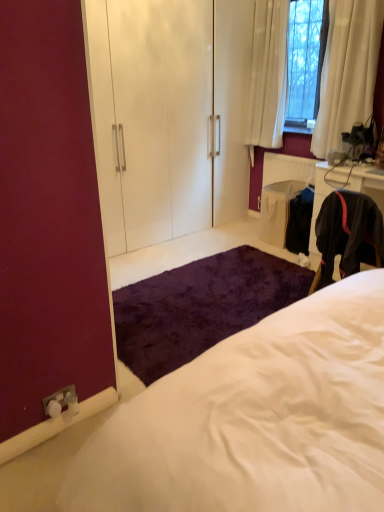
From the picture: What is the approximate width of white fluffy bed at center?

29.13 inches.

At what (x,y) coordinates should I click in order to perform the action: click on white fluffy bed at center. Please return your answer as a coordinate pair (x, y). Looking at the image, I should click on (255, 419).

Locate an element on the screen. The image size is (384, 512). black fabric at right is located at coordinates (325, 192).

Locate an element on the screen. This screenshot has height=512, width=384. white textured radiator at right is located at coordinates (287, 169).

Is white fluffy bed at center located outside shaggy purple rug at lower center?

white fluffy bed at center is positioned outside shaggy purple rug at lower center.

Is white fluffy bed at center further to the viewer compared to shaggy purple rug at lower center?

No, it is in front of shaggy purple rug at lower center.

From a real-world perspective, is white fluffy bed at center located higher than shaggy purple rug at lower center?

Indeed, from a real-world perspective, white fluffy bed at center stands above shaggy purple rug at lower center.

Does point (356, 181) come in front of point (144, 408)?

No, (356, 181) is further to viewer.

Considering the positions of objects black fabric at right and white fluffy bed at center in the image provided, who is more to the right, black fabric at right or white fluffy bed at center?

black fabric at right is more to the right.

Can we say black fabric at right lies outside white fluffy bed at center?

Yes.

Is black fabric at right shorter than white fluffy bed at center?

Yes, black fabric at right is shorter than white fluffy bed at center.

At what (x,y) coordinates should I click in order to perform the action: click on mat that is on the left side of black fabric at right. Please return your answer as a coordinate pair (x, y). The height and width of the screenshot is (512, 384). Looking at the image, I should click on (200, 307).

Can you confirm if black fabric at right is shorter than shaggy purple rug at lower center?

No.

Does black fabric at right appear on the left side of shaggy purple rug at lower center?

No, black fabric at right is not to the left of shaggy purple rug at lower center.

Which of these two, black fabric at right or shaggy purple rug at lower center, is wider?

shaggy purple rug at lower center is wider.

Between white fluffy bed at center and black fabric at right, which one has larger size?

white fluffy bed at center.

In terms of height, does white fluffy bed at center look taller or shorter compared to black fabric at right?

Considering their sizes, white fluffy bed at center has more height than black fabric at right.

Is point (325, 470) less distant than point (337, 170)?

Yes, it is in front of point (337, 170).

This screenshot has width=384, height=512. I want to click on cabinetry below the white glossy armoire at upper center (from the image's perspective), so click(325, 192).

Between point (142, 125) and point (361, 176), which one is positioned in front?

Positioned in front is point (361, 176).

Can you confirm if white glossy armoire at upper center is positioned to the right of black fabric at right?

In fact, white glossy armoire at upper center is to the left of black fabric at right.

Considering the positions of objects white glossy armoire at upper center and black fabric at right in the image provided, who is in front, white glossy armoire at upper center or black fabric at right?

white glossy armoire at upper center is in front.

Is white textured radiator at right placed right next to black fabric at right?

white textured radiator at right and black fabric at right are clearly separated.

You are a GUI agent. You are given a task and a screenshot of the screen. Output one action in this format:
    pyautogui.click(x=<x>, y=<y>)
    Task: Click on the cabinetry that appears below the white textured radiator at right (from the image's perspective)
    
    Given the screenshot: What is the action you would take?
    pyautogui.click(x=325, y=192)

From a real-world perspective, who is located higher, white textured radiator at right or black fabric at right?

white textured radiator at right.

From the image's perspective, between white textured radiator at right and white fluffy bed at center, which one is located above?

white textured radiator at right.

From their relative heights in the image, would you say white textured radiator at right is taller or shorter than white fluffy bed at center?

In the image, white textured radiator at right appears to be shorter than white fluffy bed at center.

Considering the relative sizes of white textured radiator at right and white fluffy bed at center in the image provided, is white textured radiator at right wider than white fluffy bed at center?

Incorrect, the width of white textured radiator at right does not surpass that of white fluffy bed at center.

At what (x,y) coordinates should I click in order to perform the action: click on bed lying below the shaggy purple rug at lower center (from the image's perspective). Please return your answer as a coordinate pair (x, y). Looking at the image, I should click on (255, 419).

The height and width of the screenshot is (512, 384). In order to click on bed on the left of black fabric at right in this screenshot , I will do `click(255, 419)`.

Looking at the image, which one is located closer to shaggy purple rug at lower center, white fluffy bed at center or white glossy armoire at upper center?

Among the two, white glossy armoire at upper center is located nearer to shaggy purple rug at lower center.

When comparing their distances from shaggy purple rug at lower center, does white glossy armoire at upper center or black fabric at right seem closer?

Based on the image, black fabric at right appears to be nearer to shaggy purple rug at lower center.

When comparing their distances from white textured radiator at right, does white fluffy bed at center or white glossy armoire at upper center seem closer?

white glossy armoire at upper center lies closer to white textured radiator at right than the other object.

Considering their positions, is shaggy purple rug at lower center positioned closer to white fluffy bed at center than black fabric at right?

Among the two, shaggy purple rug at lower center is located nearer to white fluffy bed at center.

Based on their spatial positions, is white textured radiator at right or white glossy armoire at upper center closer to white fluffy bed at center?

Among the two, white glossy armoire at upper center is located nearer to white fluffy bed at center.

Which object lies further to the anchor point white fluffy bed at center, black fabric at right or white textured radiator at right?

white textured radiator at right.

Looking at the image, which one is located closer to white fluffy bed at center, white glossy armoire at upper center or black fabric at right?

black fabric at right is positioned closer to the anchor white fluffy bed at center.

In the scene shown: Based on their spatial positions, is white fluffy bed at center or shaggy purple rug at lower center further from white textured radiator at right?

The object further to white textured radiator at right is white fluffy bed at center.

I want to click on armoire between white fluffy bed at center and black fabric at right from front to back, so click(151, 117).

Find the location of a particular element. This screenshot has width=384, height=512. cabinetry between shaggy purple rug at lower center and white textured radiator at right from front to back is located at coordinates (325, 192).

I want to click on mat between white fluffy bed at center and white glossy armoire at upper center from front to back, so (x=200, y=307).

Locate an element on the screen. mat positioned between white fluffy bed at center and black fabric at right from near to far is located at coordinates (200, 307).